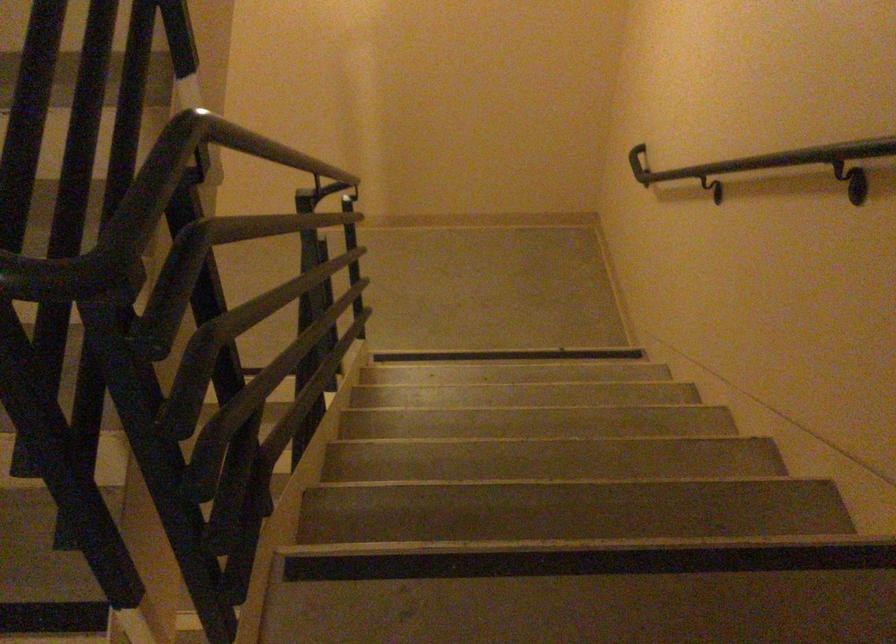
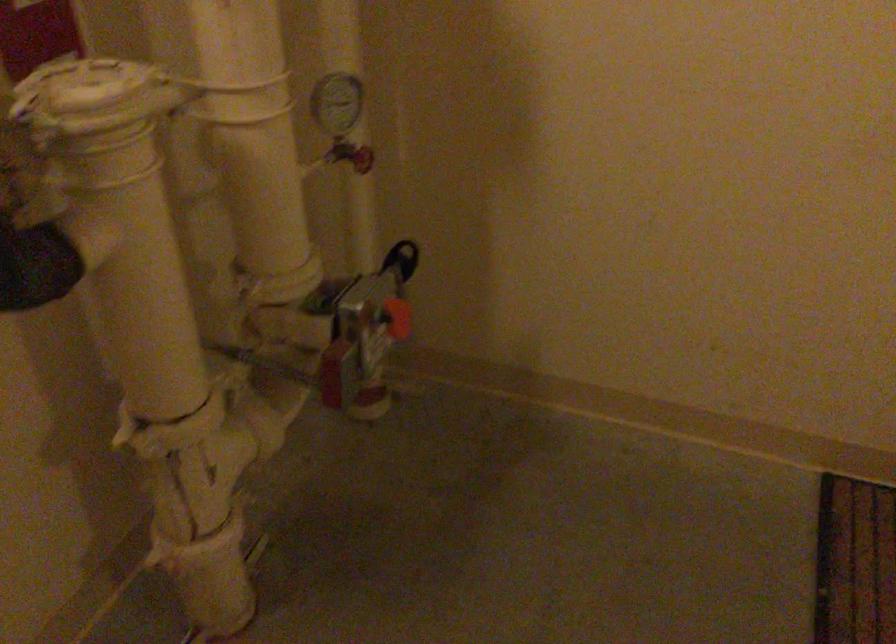
First-person continuous shooting, in which direction is the camera rotating?

The camera rotated toward left-down.